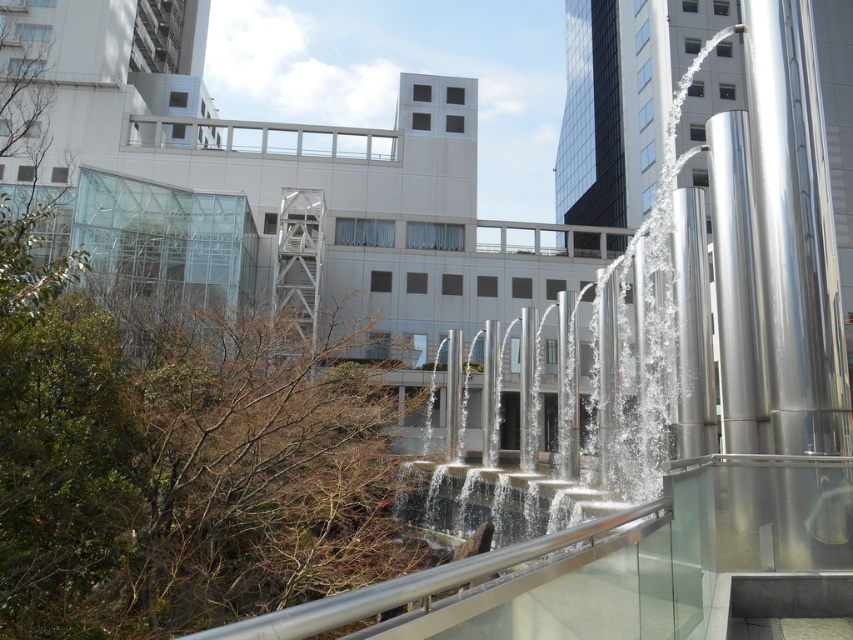
Question: Which point is closer to the camera?

Choices:
 (A) (488, 557)
 (B) (618, 486)

Answer: (A)

Question: Is silver metallic waterfall at center below silver/glass rail at center?

Choices:
 (A) yes
 (B) no

Answer: (B)

Question: Which point is farther from the camera taking this photo?

Choices:
 (A) (454, 461)
 (B) (404, 580)

Answer: (A)

Question: Which point appears closest to the camera in this image?

Choices:
 (A) (711, 394)
 (B) (322, 604)

Answer: (B)

Question: From the image, what is the correct spatial relationship of silver metallic waterfall at center in relation to silver/glass rail at center?

Choices:
 (A) left
 (B) right

Answer: (B)

Question: Is silver metallic waterfall at center smaller than silver/glass rail at center?

Choices:
 (A) yes
 (B) no

Answer: (B)